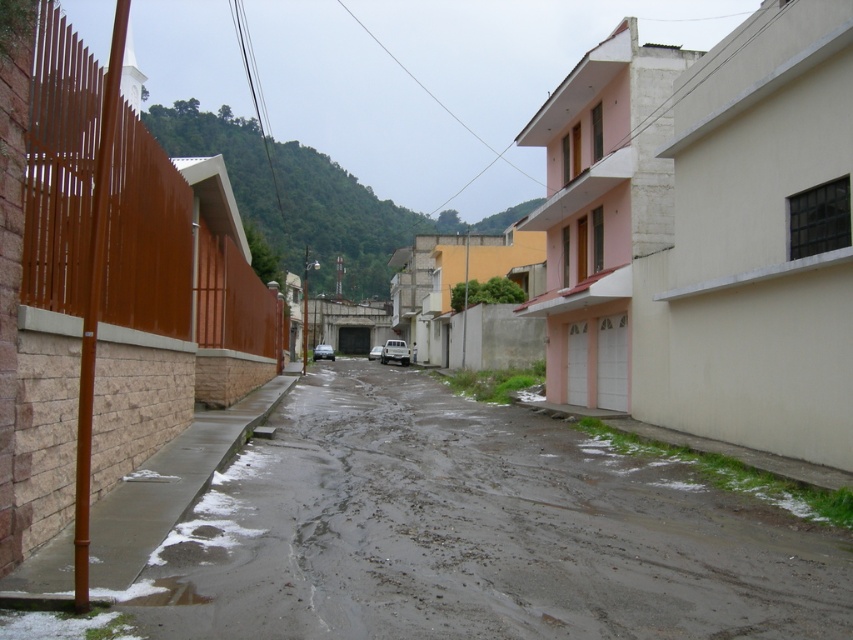
You are a delivery driver who needs to park your white matte car at center in a spot that requires backing into the parking space. There is a metallic silver car at center blocking your way. Can you safely maneuver around it?

The metallic silver car at center is located above the white matte car at center, so it is positioned higher up on the street. Since you need to back into the parking space, you can drive around the metallic silver car at center by moving to the side where there is more space, as long as there is enough clearance between the two vehicles.

You are standing at the point with coordinates point (376, 349) and want to walk to the point with coordinates point (320, 352). Given the muddy and uneven road conditions described in the scene, is the path between these two points passable for a person?

The point (320, 352) is in front of point (376, 349), so the path between them is passable for a person despite the muddy and uneven road conditions described in the scene.

You are standing at the point with coordinates point (368, 353) and want to walk to the point with coordinates point (550, 506). Given the muddy and uneven road conditions described in the scene, would you need to walk forward or backward to reach your destination?

To reach point (550, 506) from point (368, 353), you would need to walk forward since point (550, 506) is in front of point (368, 353) according to the spatial description provided.